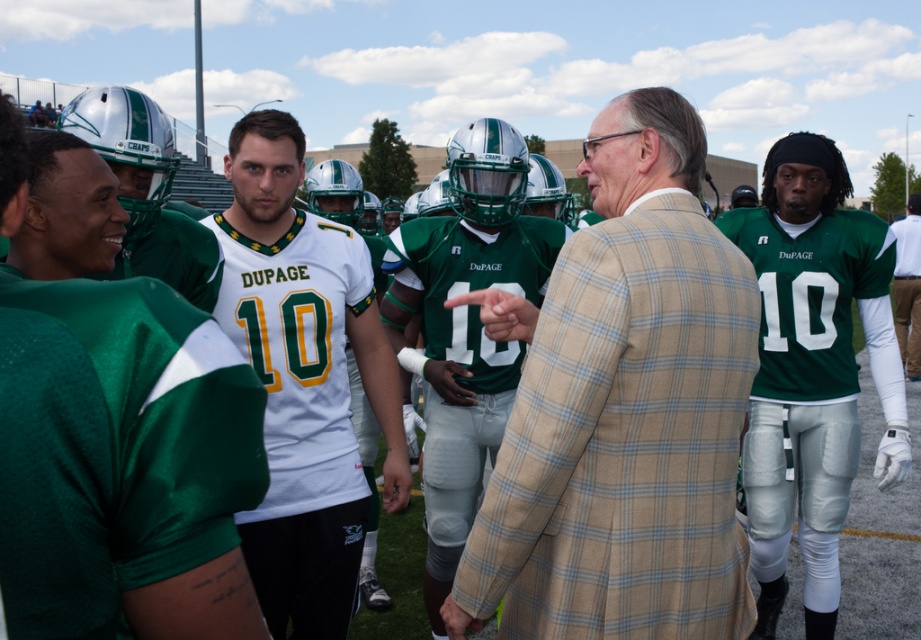
Question: Which of the following is the farthest from the observer?

Choices:
 (A) beige plaid blazer at center
 (B) white mesh jersey at center

Answer: (A)

Question: Which point is closer to the camera taking this photo?

Choices:
 (A) (907, 356)
 (B) (383, 349)

Answer: (B)

Question: Can you confirm if beige plaid blazer at center is smaller than green jersey at center?

Choices:
 (A) yes
 (B) no

Answer: (A)

Question: Which point is closer to the camera taking this photo?

Choices:
 (A) (916, 273)
 (B) (282, 388)
 (C) (10, 608)

Answer: (C)

Question: Is beige plaid blazer at center positioned at the back of green matte jersey at right?

Choices:
 (A) yes
 (B) no

Answer: (B)

Question: Where is beige plaid blazer at center located in relation to white mesh jersey at center in the image?

Choices:
 (A) below
 (B) above

Answer: (A)